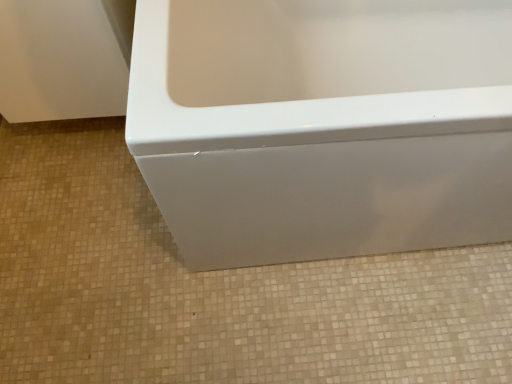
Question: Relative to white glossy bathtub at center, is white glossy bathtub at lower center in front or behind?

Choices:
 (A) behind
 (B) front

Answer: (A)

Question: Considering the relative positions of white glossy bathtub at lower center and white glossy bathtub at center in the image provided, is white glossy bathtub at lower center to the left or to the right of white glossy bathtub at center?

Choices:
 (A) right
 (B) left

Answer: (B)

Question: Based on their sizes in the image, would you say white glossy bathtub at lower center is bigger or smaller than white glossy bathtub at center?

Choices:
 (A) big
 (B) small

Answer: (B)

Question: Is white glossy bathtub at center in front of or behind white glossy bathtub at lower center in the image?

Choices:
 (A) front
 (B) behind

Answer: (A)

Question: From the image's perspective, relative to white glossy bathtub at lower center, is white glossy bathtub at center above or below?

Choices:
 (A) above
 (B) below

Answer: (A)

Question: From a real-world perspective, is white glossy bathtub at center physically located above or below white glossy bathtub at lower center?

Choices:
 (A) above
 (B) below

Answer: (A)

Question: Does point (271, 8) appear closer or farther from the camera than point (58, 225)?

Choices:
 (A) farther
 (B) closer

Answer: (B)